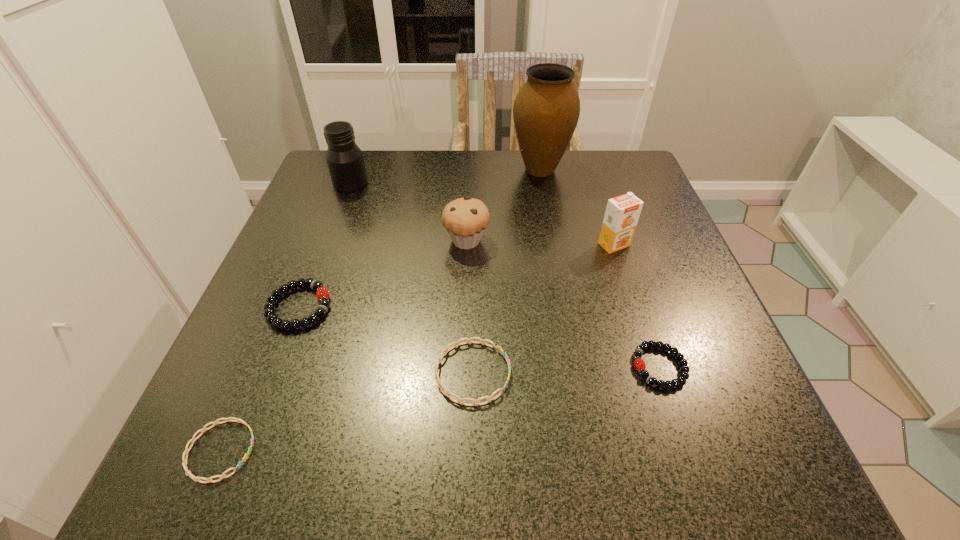
At what (x,y) coordinates should I click in order to perform the action: click on the smaller black bracelet. Please return your answer as a coordinate pair (x, y). Image resolution: width=960 pixels, height=540 pixels. Looking at the image, I should click on (639, 364).

The height and width of the screenshot is (540, 960). What are the coordinates of `the right black bracelet` in the screenshot? It's located at (639, 364).

Locate an element on the screen. the smaller blue bracelet is located at coordinates (184, 463).

Locate an element on the screen. the nearer blue bracelet is located at coordinates (184, 463).

This screenshot has height=540, width=960. What are the coordinates of `vacant space located on the left of the tallest object` in the screenshot? It's located at (474, 170).

Locate an element on the screen. vacant space located 0.090m on the right of the seventh shortest object is located at coordinates (405, 183).

Where is `free point located on the front of the sixth shortest object`? Image resolution: width=960 pixels, height=540 pixels. free point located on the front of the sixth shortest object is located at coordinates (643, 333).

This screenshot has width=960, height=540. In order to click on free space located on the front of the fourth tallest object in this screenshot , I will do `click(462, 377)`.

Locate an element on the screen. This screenshot has width=960, height=540. vacant space located on the front of the fourth nearest object is located at coordinates (251, 435).

The image size is (960, 540). I want to click on free space located on the surface of the bigger blue bracelet showing star-shaped elements, so click(606, 373).